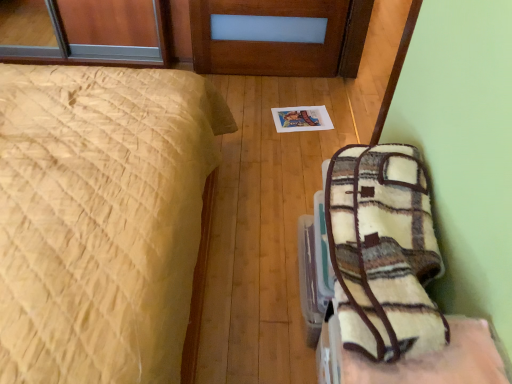
Question: From the image's perspective, is white fuzzy blanket at lower right positioned above or below plush fleece blanket at lower right?

Choices:
 (A) below
 (B) above

Answer: (B)

Question: Which is correct: white fuzzy blanket at lower right is inside plush fleece blanket at lower right, or outside of it?

Choices:
 (A) inside
 (B) outside

Answer: (B)

Question: Which object is positioned closest to the yellow quilted bed at left?

Choices:
 (A) plush fleece blanket at lower right
 (B) white fuzzy blanket at lower right

Answer: (B)

Question: Considering the real-world distances, which object is farthest from the white fuzzy blanket at lower right?

Choices:
 (A) yellow quilted bed at left
 (B) plush fleece blanket at lower right

Answer: (A)